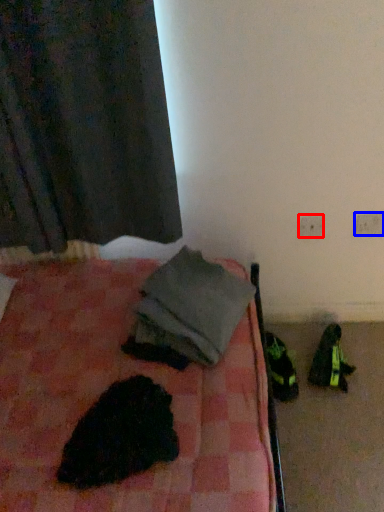
Question: Which point is further to the camera, electric outlet (highlighted by a red box) or electric outlet (highlighted by a blue box)?

Choices:
 (A) electric outlet
 (B) electric outlet

Answer: (A)